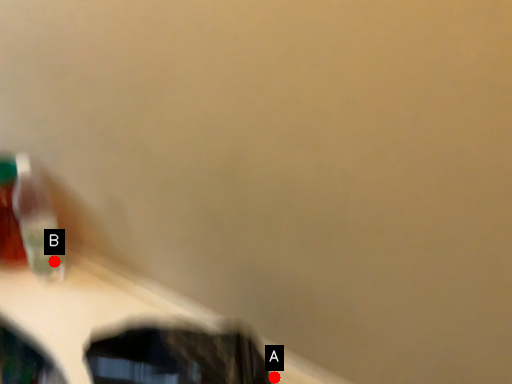
Question: Two points are circled on the image, labeled by A and B beside each circle. Which point appears farthest from the camera in this image?

Choices:
 (A) A is further
 (B) B is further

Answer: (B)